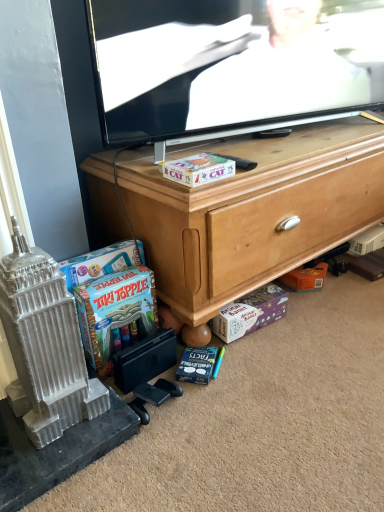
Find the location of a particular element. The height and width of the screenshot is (512, 384). free space between blue matte book at lower center and purple cardboard box at lower center, which is the 1th cash from right to left is located at coordinates pos(241,352).